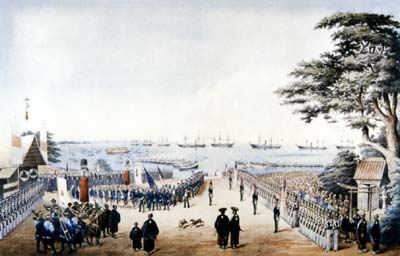
Where is `painting`? The height and width of the screenshot is (256, 400). painting is located at coordinates (194, 95).